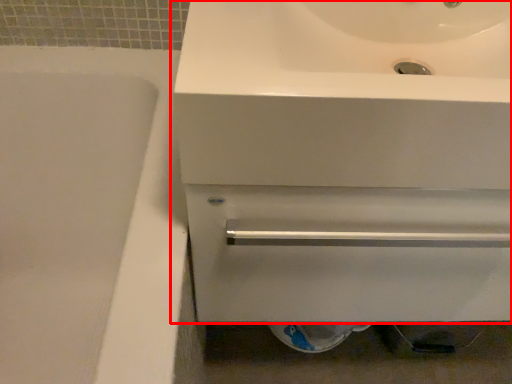
Question: Observing the image, what is the correct spatial positioning of sink (annotated by the red box) in reference to bath?

Choices:
 (A) left
 (B) right

Answer: (B)